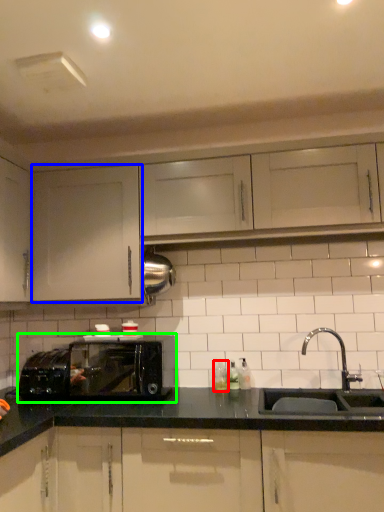
Question: Which object is positioned farthest from bottle (highlighted by a red box)? Select from cabinetry (highlighted by a blue box) and microwave oven (highlighted by a green box).

Choices:
 (A) cabinetry
 (B) microwave oven

Answer: (A)